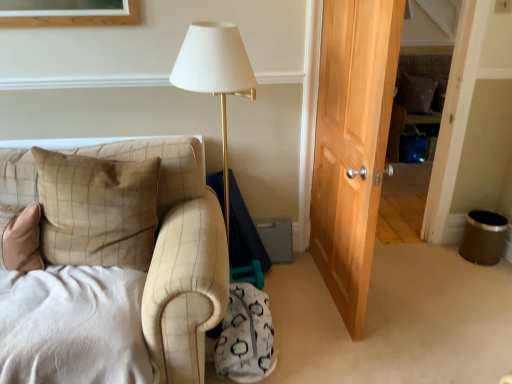
Question: Would you say velvet brown pillow at upper right, placed as the first pillow when sorted from right to left, is part of beige plaid pillow at left, the 1th pillow from the front,'s contents?

Choices:
 (A) yes
 (B) no

Answer: (B)

Question: From the image's perspective, would you say beige plaid pillow at left, which is counted as the 2th pillow, starting from the right, is shown under velvet brown pillow at upper right, acting as the second pillow starting from the bottom?

Choices:
 (A) no
 (B) yes

Answer: (B)

Question: Is beige plaid pillow at left, the 1th pillow from the front, not close to velvet brown pillow at upper right, placed as the first pillow when sorted from right to left?

Choices:
 (A) yes
 (B) no

Answer: (A)

Question: Is beige plaid pillow at left, positioned as the first pillow in left-to-right order, at the right side of velvet brown pillow at upper right, placed as the first pillow when sorted from right to left?

Choices:
 (A) yes
 (B) no

Answer: (B)

Question: Can we say beige plaid pillow at left, which is the first pillow from bottom to top, lies outside velvet brown pillow at upper right, the second pillow viewed from the left?

Choices:
 (A) yes
 (B) no

Answer: (A)

Question: Considering the relative positions of beige plaid pillow at left, which ranks as the 2th pillow in back-to-front order, and velvet brown pillow at upper right, the second pillow viewed from the left, in the image provided, is beige plaid pillow at left, which ranks as the 2th pillow in back-to-front order, to the left of velvet brown pillow at upper right, the second pillow viewed from the left, from the viewer's perspective?

Choices:
 (A) yes
 (B) no

Answer: (A)

Question: Are velvet brown pillow at upper right, the first pillow when ordered from top to bottom, and beige plaid pillow at left, the second pillow viewed from the top, beside each other?

Choices:
 (A) no
 (B) yes

Answer: (A)

Question: Could you tell me if velvet brown pillow at upper right, acting as the second pillow starting from the bottom, is turned towards beige plaid pillow at left, the 1th pillow from the front?

Choices:
 (A) no
 (B) yes

Answer: (A)

Question: Considering the relative positions of velvet brown pillow at upper right, which is counted as the 2th pillow, starting from the front, and beige plaid pillow at left, which ranks as the 2th pillow in back-to-front order, in the image provided, is velvet brown pillow at upper right, which is counted as the 2th pillow, starting from the front, to the left of beige plaid pillow at left, which ranks as the 2th pillow in back-to-front order, from the viewer's perspective?

Choices:
 (A) yes
 (B) no

Answer: (B)

Question: Considering the relative positions of velvet brown pillow at upper right, acting as the second pillow starting from the bottom, and beige plaid pillow at left, which is counted as the 2th pillow, starting from the right, in the image provided, is velvet brown pillow at upper right, acting as the second pillow starting from the bottom, to the right of beige plaid pillow at left, which is counted as the 2th pillow, starting from the right, from the viewer's perspective?

Choices:
 (A) no
 (B) yes

Answer: (B)

Question: Is beige plaid pillow at left, which is counted as the 2th pillow, starting from the right, a part of velvet brown pillow at upper right, acting as the second pillow starting from the bottom?

Choices:
 (A) no
 (B) yes

Answer: (A)

Question: Considering the relative positions of velvet brown pillow at upper right, acting as the 1th pillow starting from the back, and beige plaid pillow at left, which ranks as the 2th pillow in back-to-front order, in the image provided, is velvet brown pillow at upper right, acting as the 1th pillow starting from the back, behind beige plaid pillow at left, which ranks as the 2th pillow in back-to-front order,?

Choices:
 (A) yes
 (B) no

Answer: (A)

Question: Does point (99, 163) appear closer or farther from the camera than point (400, 79)?

Choices:
 (A) closer
 (B) farther

Answer: (A)